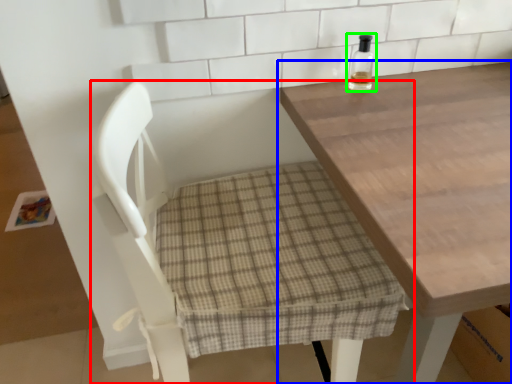
Question: Estimate the real-world distances between objects in this image. Which object is closer to chair (highlighted by a red box), table (highlighted by a blue box) or bottle (highlighted by a green box)?

Choices:
 (A) table
 (B) bottle

Answer: (A)